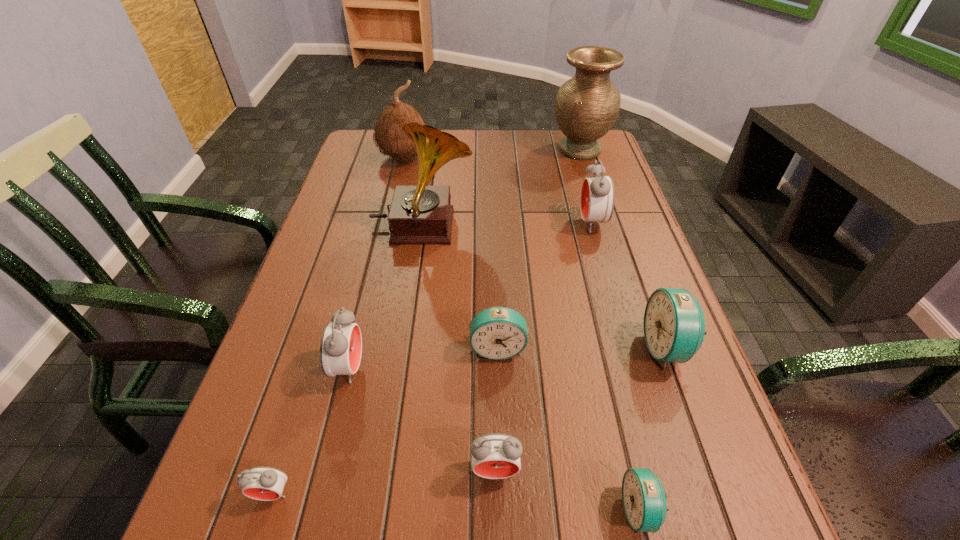
Where is `the third red alarm clock from left to right`? the third red alarm clock from left to right is located at coordinates (494, 456).

Where is `the leftmost alarm clock`? Image resolution: width=960 pixels, height=540 pixels. the leftmost alarm clock is located at coordinates (262, 483).

Locate an element on the screen. The image size is (960, 540). the smallest red alarm clock is located at coordinates (262, 483).

At what (x,y) coordinates should I click in order to perform the action: click on vacant region located 0.360m on the left of the green vase. Please return your answer as a coordinate pair (x, y). Image resolution: width=960 pixels, height=540 pixels. Looking at the image, I should click on (439, 150).

Where is `vacant position located from the horn of the phonograph record`? The image size is (960, 540). vacant position located from the horn of the phonograph record is located at coordinates (558, 227).

The height and width of the screenshot is (540, 960). What are the coordinates of `vacant space situated on the surface of the coconut` in the screenshot? It's located at (388, 228).

Find the location of a particular element. free location located 0.050m on the face of the farthest alarm clock is located at coordinates (560, 224).

Locate an element on the screen. The height and width of the screenshot is (540, 960). blank space located 0.360m on the face of the farthest alarm clock is located at coordinates (443, 224).

This screenshot has height=540, width=960. Identify the location of vacant point located on the face of the farthest alarm clock. (515, 224).

Where is `free location located on the face of the third red alarm clock from right to left`? The image size is (960, 540). free location located on the face of the third red alarm clock from right to left is located at coordinates (515, 368).